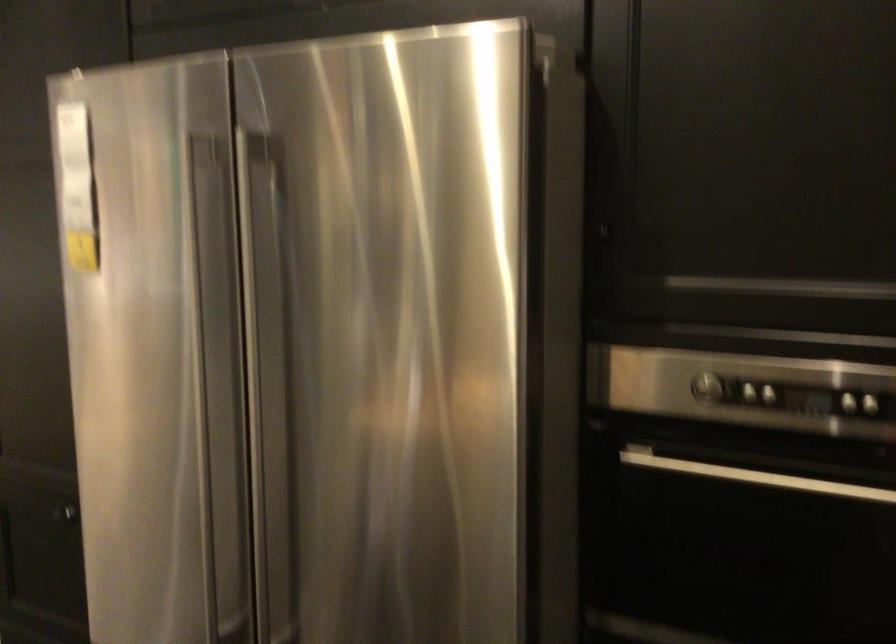
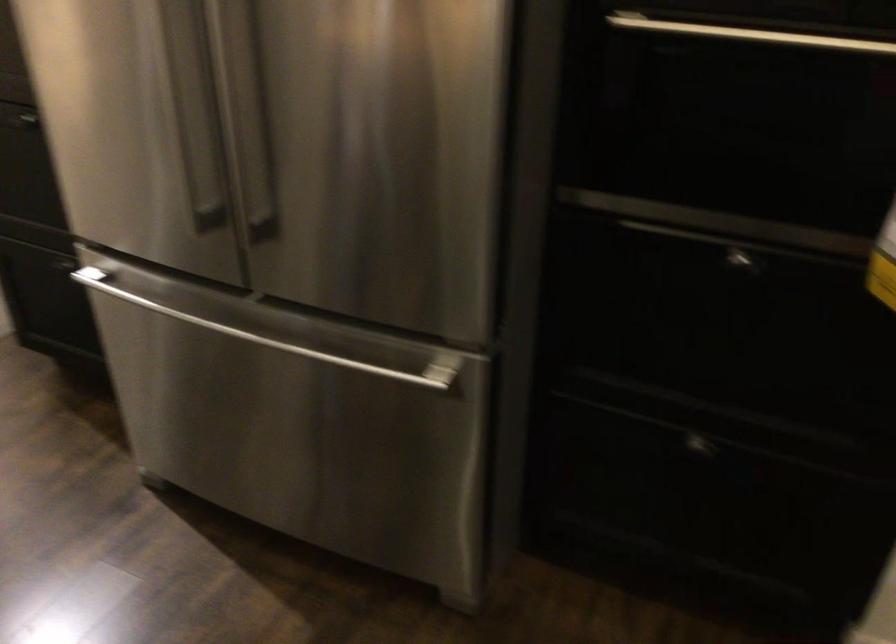
Question: What movement of the cameraman would produce the second image?

Choices:
 (A) Left
 (B) Right
 (C) Forward
 (D) Backward

Answer: (A)